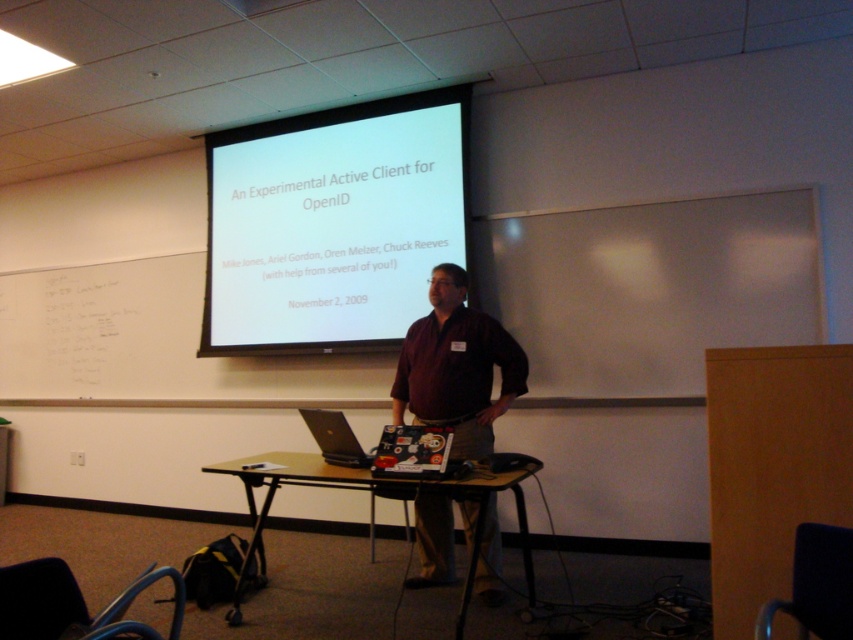
Find the location of `white matte projector screen at upper center`. white matte projector screen at upper center is located at coordinates (332, 224).

Identify the location of white matte projector screen at upper center. (332, 224).

Who is shorter, brown wooden table at center or silver metallic laptop at center?

Standing shorter between the two is silver metallic laptop at center.

In order to click on brown wooden table at center in this screenshot , I will do `click(374, 488)`.

Does point (355, 481) come farther from viewer compared to point (302, 416)?

No, (355, 481) is closer to viewer.

Locate an element on the screen. brown wooden table at center is located at coordinates 374,488.

Is brown matte shirt at center taller than silver metallic laptop at center?

Indeed, brown matte shirt at center has a greater height compared to silver metallic laptop at center.

Measure the distance between brown matte shirt at center and camera.

brown matte shirt at center and camera are 10.45 feet apart from each other.

Where is `brown matte shirt at center`? This screenshot has width=853, height=640. brown matte shirt at center is located at coordinates (456, 365).